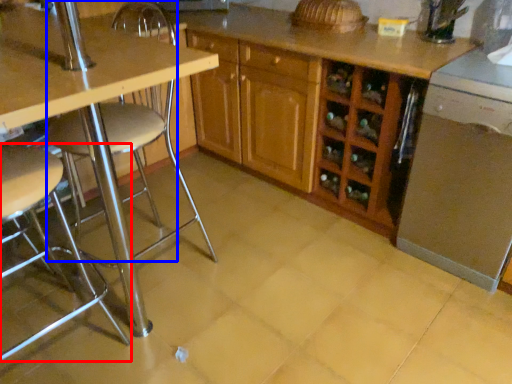
Question: Among these objects, which one is farthest to the camera, chair (highlighted by a red box) or swivel chair (highlighted by a blue box)?

Choices:
 (A) chair
 (B) swivel chair

Answer: (B)